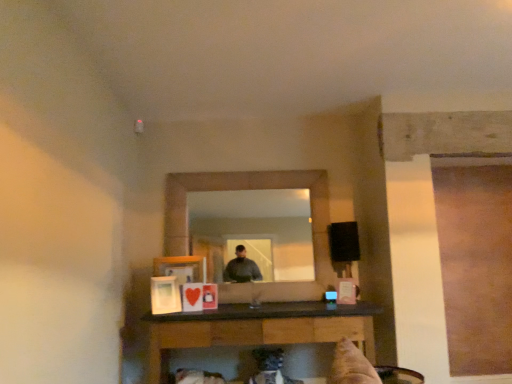
Question: Is black glossy table at lower center at the left side of matte wooden mirror at center?

Choices:
 (A) no
 (B) yes

Answer: (A)

Question: Can you confirm if black glossy table at lower center is taller than matte wooden mirror at center?

Choices:
 (A) yes
 (B) no

Answer: (B)

Question: Is black glossy table at lower center bigger than matte wooden mirror at center?

Choices:
 (A) no
 (B) yes

Answer: (B)

Question: Is black glossy table at lower center positioned in front of matte wooden mirror at center?

Choices:
 (A) yes
 (B) no

Answer: (A)

Question: Would you say black glossy table at lower center is a long distance from matte wooden mirror at center?

Choices:
 (A) yes
 (B) no

Answer: (A)

Question: Does black glossy table at lower center have a lesser height compared to matte wooden mirror at center?

Choices:
 (A) yes
 (B) no

Answer: (A)

Question: From a real-world perspective, is matte wooden mirror at center over black glossy table at lower center?

Choices:
 (A) yes
 (B) no

Answer: (A)

Question: Is matte wooden mirror at center at the right side of black glossy table at lower center?

Choices:
 (A) yes
 (B) no

Answer: (B)

Question: Can you confirm if matte wooden mirror at center is taller than black glossy table at lower center?

Choices:
 (A) yes
 (B) no

Answer: (A)

Question: Is matte wooden mirror at center smaller than black glossy table at lower center?

Choices:
 (A) yes
 (B) no

Answer: (A)

Question: Considering the relative sizes of matte wooden mirror at center and black glossy table at lower center in the image provided, is matte wooden mirror at center wider than black glossy table at lower center?

Choices:
 (A) no
 (B) yes

Answer: (A)

Question: Would you consider matte wooden mirror at center to be distant from black glossy table at lower center?

Choices:
 (A) no
 (B) yes

Answer: (B)

Question: Considering the positions of matte wooden mirror at center and black glossy table at lower center in the image, is matte wooden mirror at center wider or thinner than black glossy table at lower center?

Choices:
 (A) thin
 (B) wide

Answer: (A)